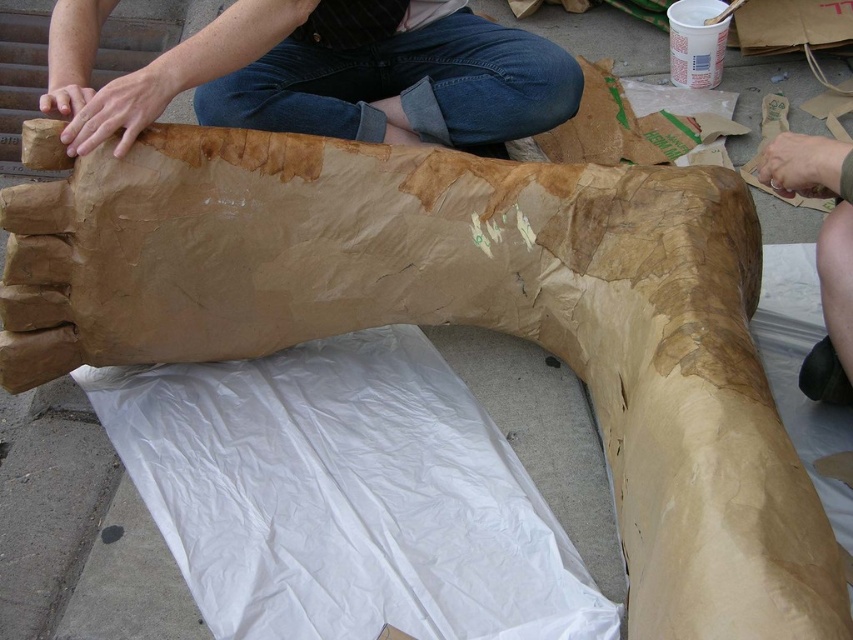
You are standing in front of the paper mache structure and notice two points marked on it. The first point is at coordinates point [380,76] and the second is at point [779,138]. Which point is closer to you?

Point [380,76] is closer to you because it is further to the viewer than point [779,138].

You are an architect designing a model of the structure shown in the image. You need to place a small light at the exact center of the brown paper at upper center. According to the coordinates provided, what are the coordinates where you should place the light?

The coordinates for the exact center of the brown paper at upper center are at point (311, 76).